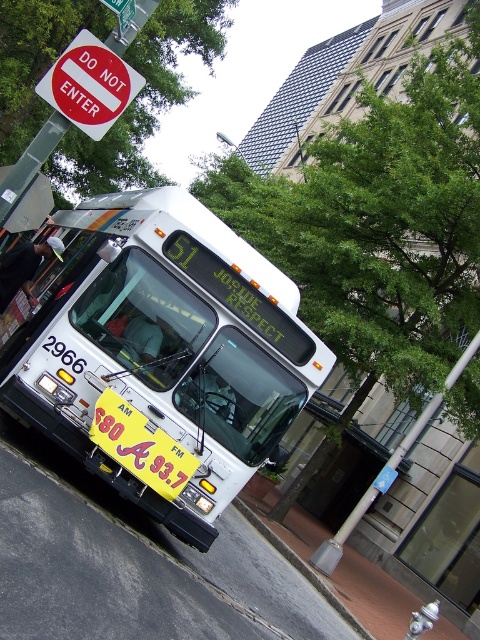
Question: Which is nearer to the green leafy tree at center?

Choices:
 (A) red plastic sign at upper left
 (B) yellow fabric sign at lower left

Answer: (A)

Question: Is the position of green leafy tree at upper center more distant than that of yellow fabric sign at lower left?

Choices:
 (A) yes
 (B) no

Answer: (A)

Question: Is red plastic sign at upper left to the right of yellow fabric sign at lower left from the viewer's perspective?

Choices:
 (A) yes
 (B) no

Answer: (B)

Question: Which point appears farthest from the camera in this image?

Choices:
 (A) (383, 296)
 (B) (121, 275)

Answer: (A)

Question: Which object appears farthest from the camera in this image?

Choices:
 (A) red plastic sign at upper left
 (B) green leafy tree at center
 (C) white metallic bus at center

Answer: (B)

Question: Does green leafy tree at center have a greater width compared to red plastic sign at upper left?

Choices:
 (A) no
 (B) yes

Answer: (B)